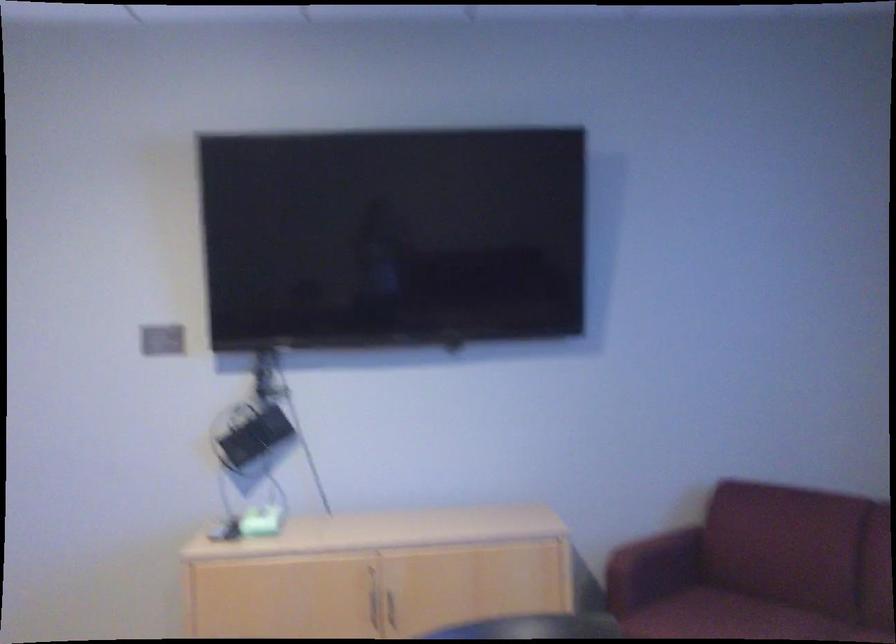
Describe the element at coordinates (652, 567) in the screenshot. I see `the red chair armrest` at that location.